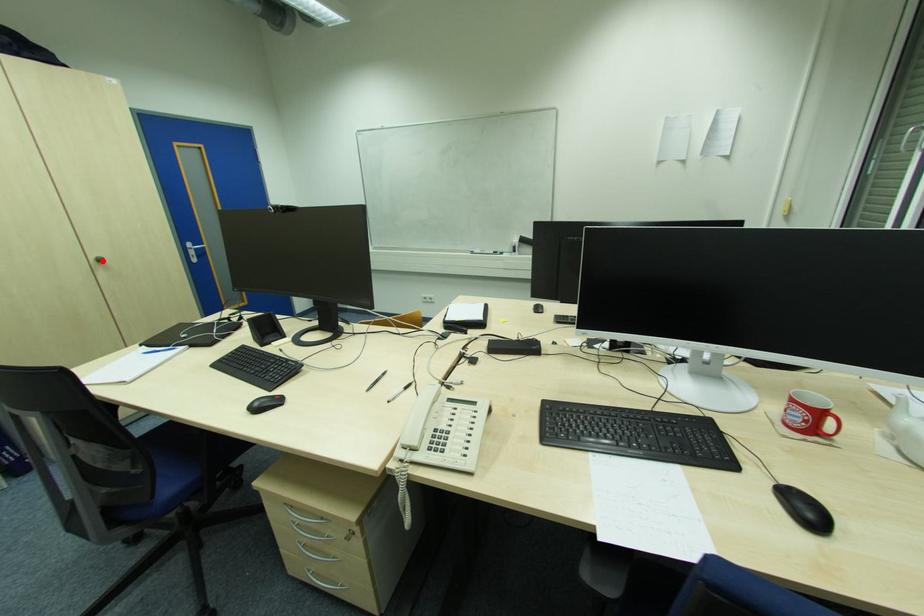
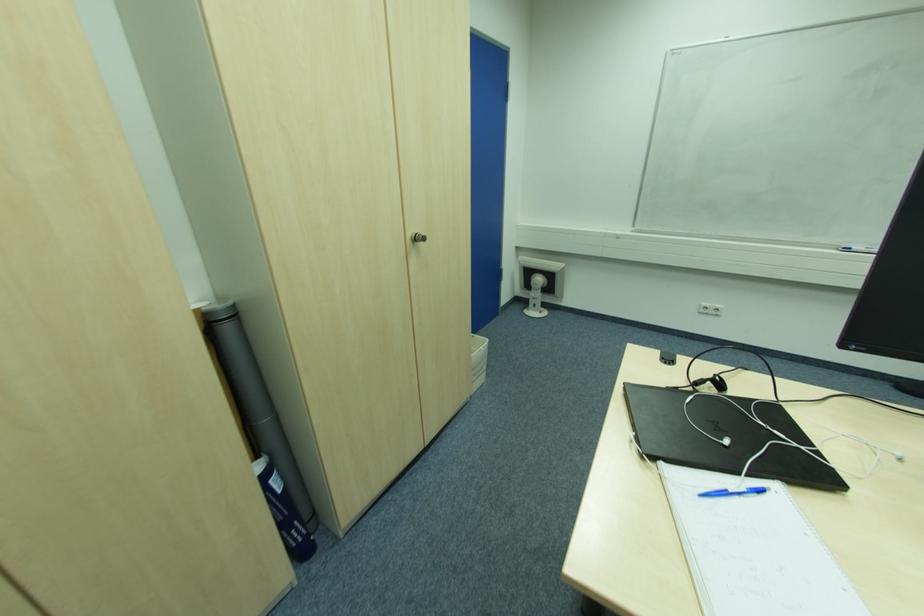
The point at the highlighted location is marked in the first image. Where is the corresponding point in the second image?

(419, 240)